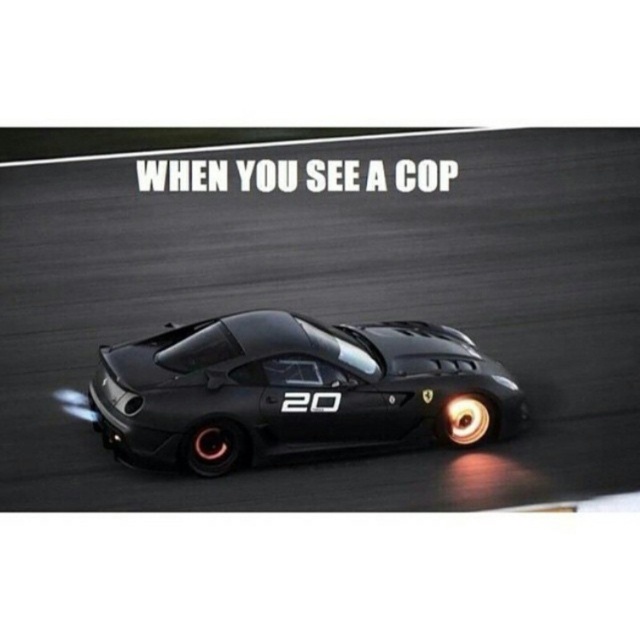
You are a drone operator controlling a drone that is 2 meters away from the Ferrari. You need to capture a closeup shot of the Ferrari emblem near the front wheel. The camera is positioned at point (468, 248). Is the drone close enough to get a clear shot of the Ferrari emblem near the front wheel?

The distance between point (468, 248) and the camera is 10.56 meters. Since the drone is only 2 meters away from the Ferrari, it is much closer, so the drone can get a clear shot of the Ferrari emblem near the front wheel.

You are a race car driver preparing to make a sharp turn on the track. You notice the black asphalt at center and the matte black sports car at center. Which object should you steer towards to stay on the racing path?

You should steer towards the black asphalt at center because it is positioned on the right side of the matte black sports car at center, indicating it is part of the track where the car should stay.